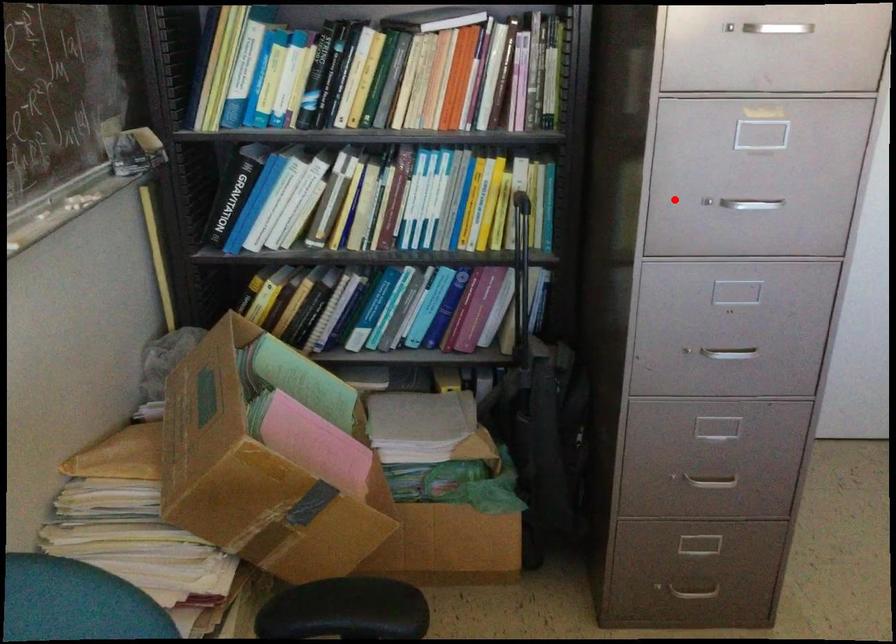
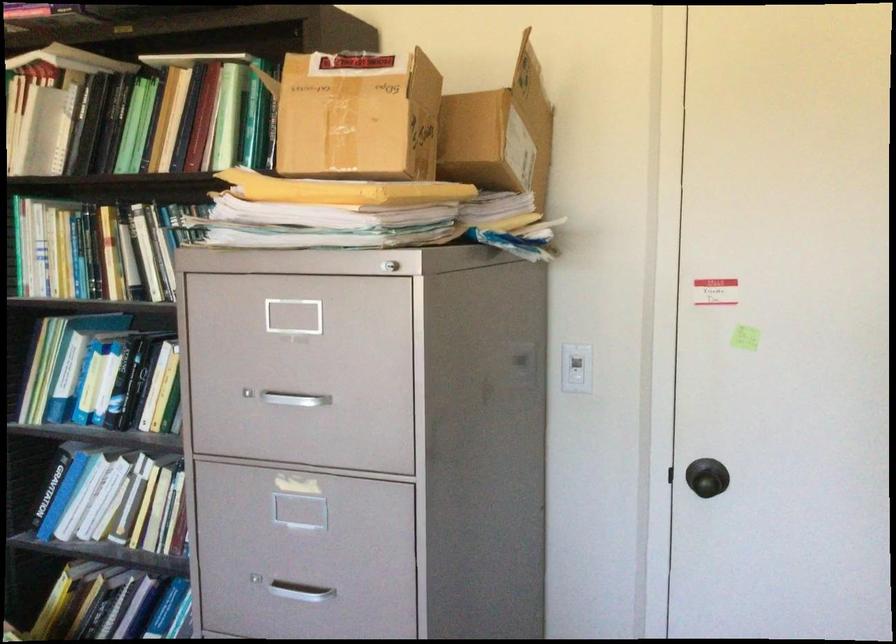
In the second image, find the point that corresponds to the highlighted location in the first image.

(252, 574)